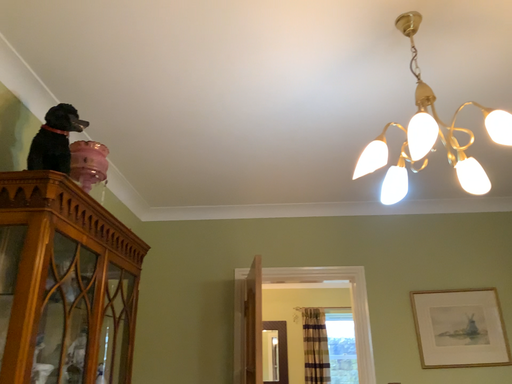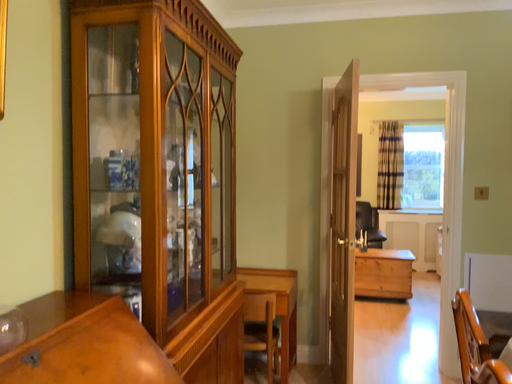
Question: How did the camera likely rotate when shooting the video?

Choices:
 (A) rotated upward
 (B) rotated downward

Answer: (B)